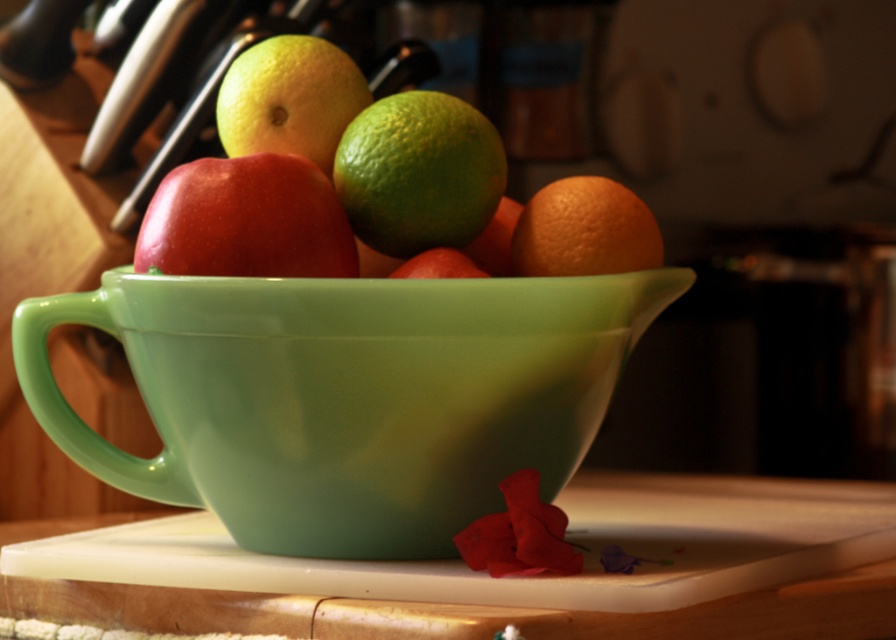
Question: Can you confirm if glossy ceramic bowl at center is positioned above smooth yellow grapefruit at center?

Choices:
 (A) no
 (B) yes

Answer: (A)

Question: Among these points, which one is farthest from the camera?

Choices:
 (A) click(170, 541)
 (B) click(235, 120)
 (C) click(225, 356)

Answer: (A)

Question: Is green matte lime at center behind matte red apple at center?

Choices:
 (A) no
 (B) yes

Answer: (B)

Question: Which point is closer to the camera?

Choices:
 (A) (263, 236)
 (B) (392, 125)
 (C) (390, 275)

Answer: (A)

Question: Is white plastic cutting board at lower center bigger than matte red apple at center?

Choices:
 (A) yes
 (B) no

Answer: (A)

Question: Which point is closer to the camera taking this photo?

Choices:
 (A) pos(462,280)
 (B) pos(468,275)
 (C) pos(336,61)
 (D) pos(452,118)

Answer: (A)